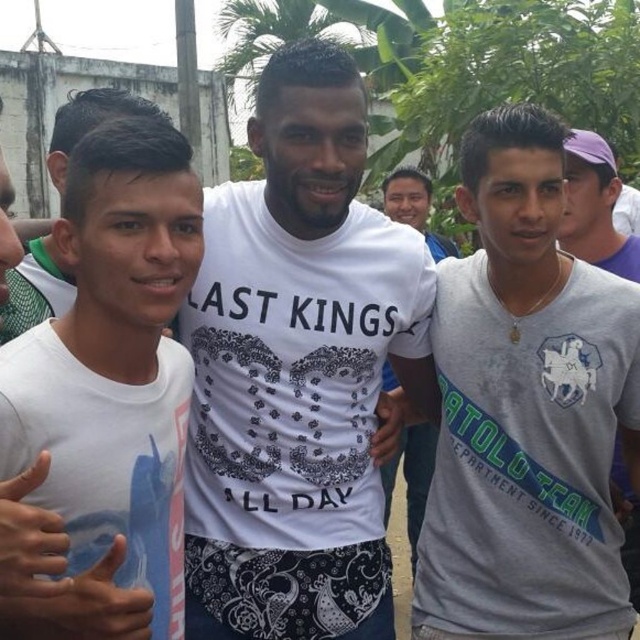
Question: Which point is farther to the camera?

Choices:
 (A) (134, 154)
 (B) (506, 307)
 (C) (413, 512)

Answer: (C)

Question: Among these points, which one is farthest from the camera?

Choices:
 (A) (88, 554)
 (B) (545, 234)

Answer: (B)

Question: Is gray matte shirt at center to the right of white matte t-shirt at center from the viewer's perspective?

Choices:
 (A) yes
 (B) no

Answer: (A)

Question: Which object is farther from the camera taking this photo?

Choices:
 (A) white printed t-shirt at center
 (B) gray matte shirt at center

Answer: (A)

Question: Does gray matte shirt at center have a greater width compared to white matte t-shirt at center?

Choices:
 (A) no
 (B) yes

Answer: (B)

Question: Can you confirm if gray matte shirt at center is wider than white printed t-shirt at center?

Choices:
 (A) yes
 (B) no

Answer: (A)